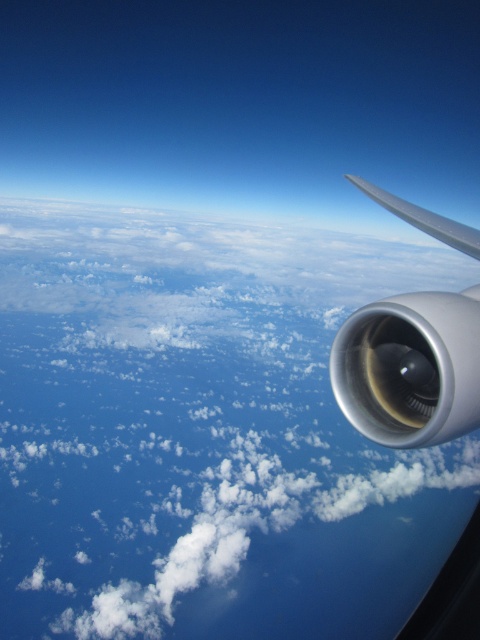
Question: Is sleek metallic engine at right bigger than silver metallic wing at upper right?

Choices:
 (A) no
 (B) yes

Answer: (A)

Question: Which of the following is the farthest from the observer?

Choices:
 (A) (361, 179)
 (B) (12, 348)

Answer: (B)

Question: Observing the image, what is the correct spatial positioning of white fluffy cloud at upper center in reference to silver metallic wing at upper right?

Choices:
 (A) left
 (B) right

Answer: (B)

Question: Which of the following is the farthest from the observer?

Choices:
 (A) white fluffy cloud at upper center
 (B) sleek metallic engine at right

Answer: (A)

Question: Does white fluffy cloud at upper center appear over silver metallic wing at upper right?

Choices:
 (A) no
 (B) yes

Answer: (B)

Question: Which of the following is the farthest from the observer?

Choices:
 (A) (241, 330)
 (B) (408, 356)
 (C) (368, 186)

Answer: (A)